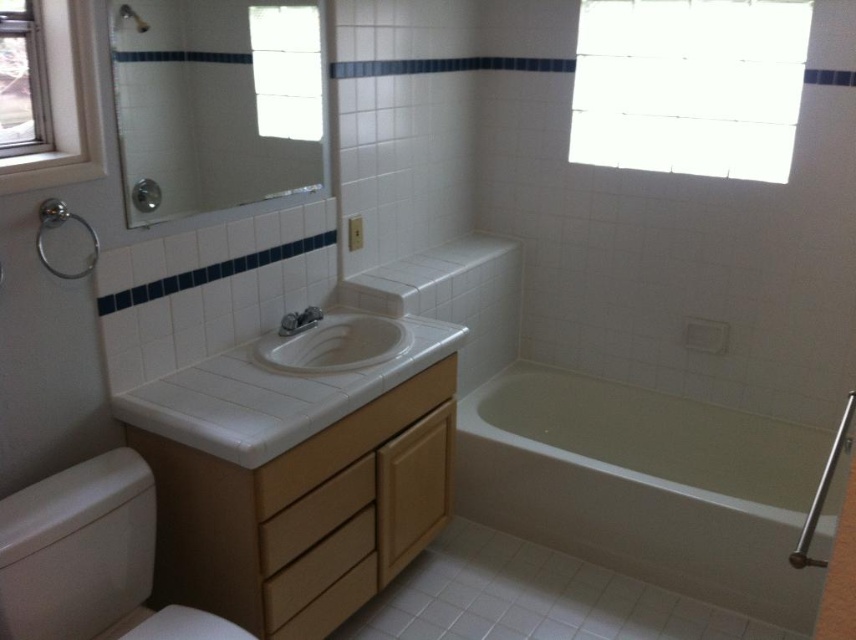
You are standing in the bathroom and looking at the two points marked in the scene. Which point is closer to you, point at coordinates (490,497) or point at coordinates (16,58)?

Point at coordinates (16,58) is closer to you because it is less further to the camera than point at coordinates (490,497).

You are standing in the bathroom and want to dry off after a shower. The white glossy bathtub at lower right is still wet. Where should you stand to let the clear glass window at upper left help dry the bathtub?

You should stand the white glossy bathtub at lower right under the clear glass window at upper left because the window is above it, allowing sunlight to reach and dry the bathtub.